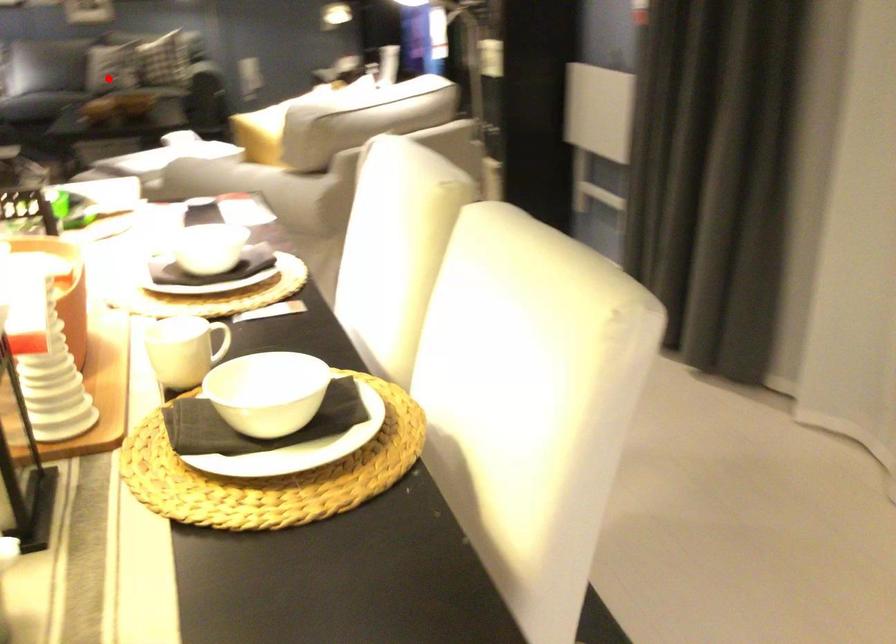
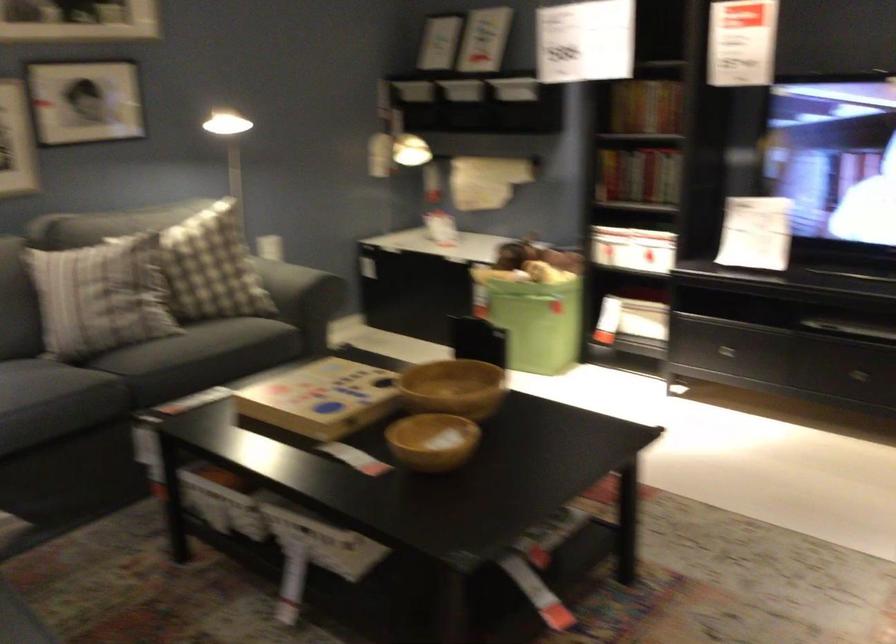
Where in the second image is the point corresponding to the highlighted location from the first image?

(199, 357)